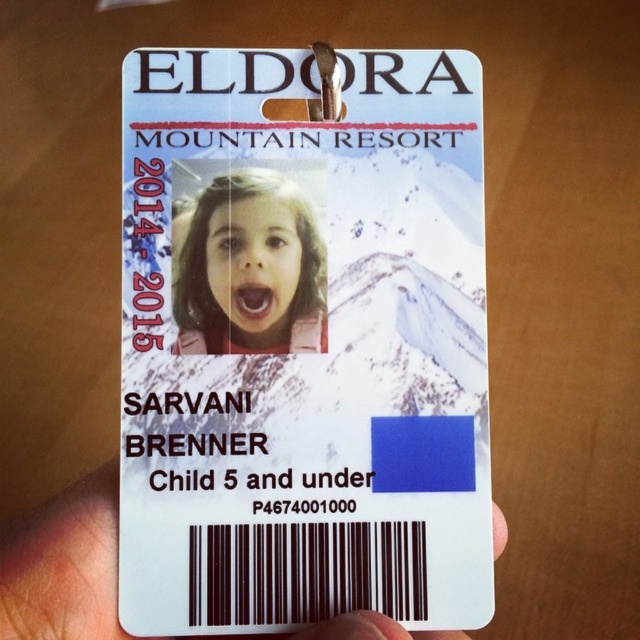
Image resolution: width=640 pixels, height=640 pixels. I want to click on white plastic card at center, so click(x=301, y=342).

Which is behind, point (134, 442) or point (29, 637)?

The point (134, 442) is behind.

The width and height of the screenshot is (640, 640). In order to click on white plastic card at center in this screenshot , I will do `click(301, 342)`.

Is point (461, 460) behind point (244, 209)?

No, it is not.

Between white plastic card at center and matte plastic photo at center, which one has more height?

white plastic card at center

This screenshot has height=640, width=640. Find the location of `white plastic card at center`. white plastic card at center is located at coordinates (301, 342).

At what (x,y) coordinates should I click in order to perform the action: click on white plastic card at center. Please return your answer as a coordinate pair (x, y). Looking at the image, I should click on (301, 342).

Who is lower down, matte plastic photo at center or white plastic hand at lower center?

white plastic hand at lower center is below.

Who is positioned more to the right, matte plastic photo at center or white plastic hand at lower center?

white plastic hand at lower center

Who is more distant from viewer, (180, 348) or (48, 538)?

Positioned behind is point (180, 348).

I want to click on matte plastic photo at center, so click(250, 269).